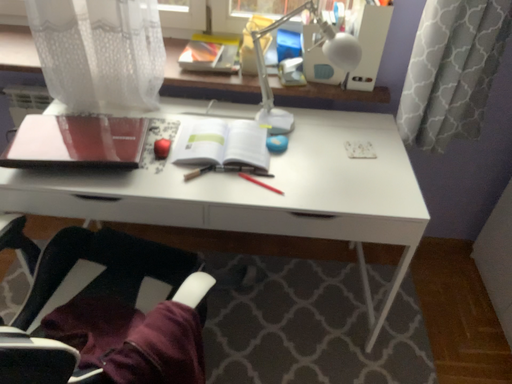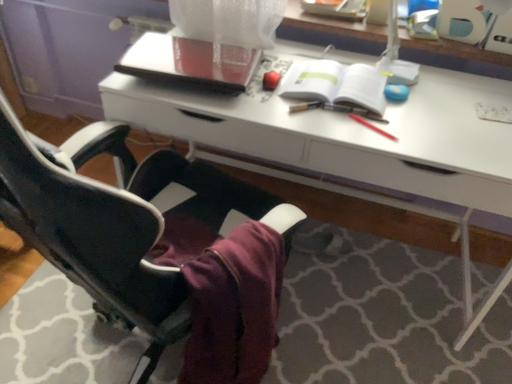
Question: Which way did the camera rotate in the video?

Choices:
 (A) rotated left
 (B) rotated right

Answer: (A)